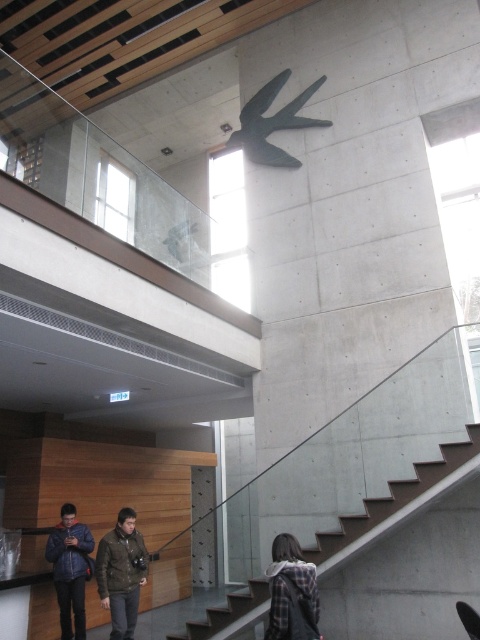
Question: Is concrete stairs at center to the left of dark green jacket at lower center from the viewer's perspective?

Choices:
 (A) no
 (B) yes

Answer: (A)

Question: Among these objects, which one is nearest to the camera?

Choices:
 (A) denim jacket at lower left
 (B) dark green jacket at lower center

Answer: (B)

Question: Which of the following is the closest to the observer?

Choices:
 (A) plaid fabric at lower right
 (B) dark green jacket at lower center
 (C) concrete stairs at center

Answer: (A)

Question: Among these points, which one is nearest to the camera?

Choices:
 (A) (110, 566)
 (B) (284, 589)
 (C) (62, 524)

Answer: (B)

Question: Is denim jacket at lower left closer to the viewer compared to plaid fabric at lower right?

Choices:
 (A) yes
 (B) no

Answer: (B)

Question: Does concrete stairs at center have a greater width compared to dark green jacket at lower center?

Choices:
 (A) no
 (B) yes

Answer: (B)